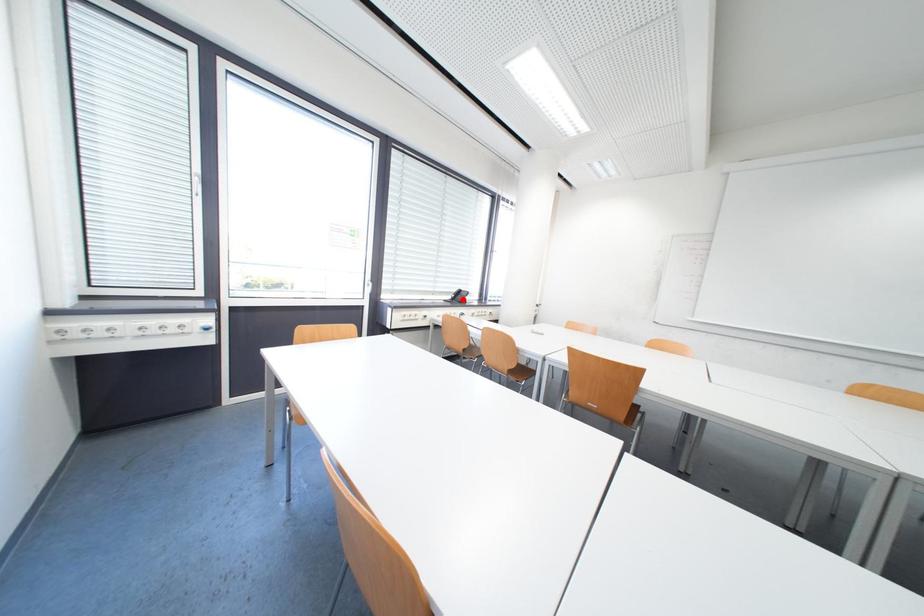
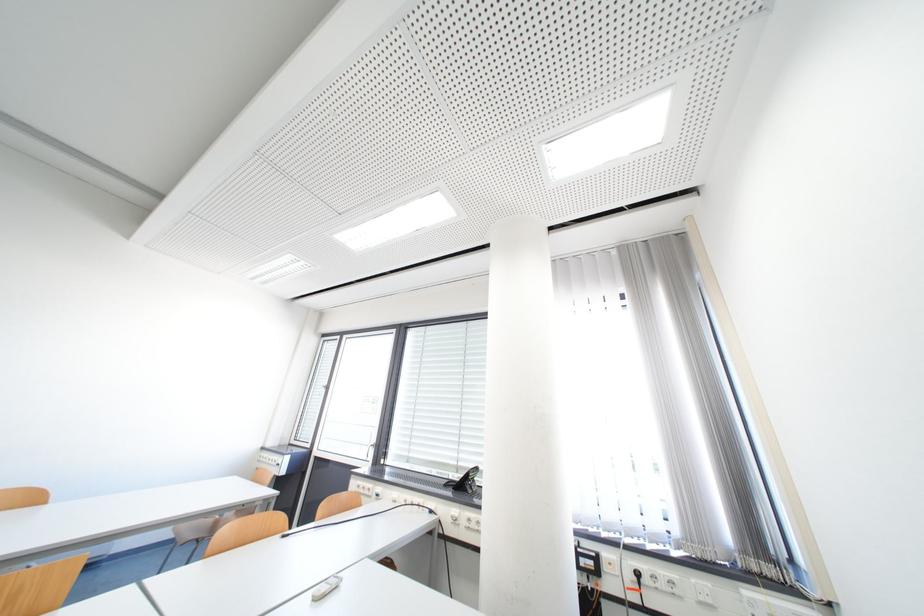
The point at the highlighted location is marked in the first image. Where is the corresponding point in the second image?

(478, 483)